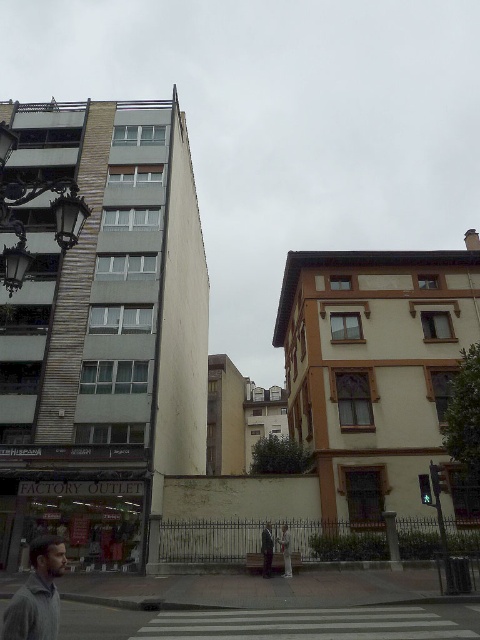
Who is taller, gray woolen sweater at lower left or dark gray suit at center?

Standing taller between the two is gray woolen sweater at lower left.

Does point (28, 593) come closer to viewer compared to point (264, 557)?

Yes, point (28, 593) is closer to viewer.

Between point (29, 563) and point (268, 538), which one is positioned in front?

Positioned in front is point (268, 538).

The width and height of the screenshot is (480, 640). Find the location of `gray woolen sweater at lower left`. gray woolen sweater at lower left is located at coordinates [x=36, y=593].